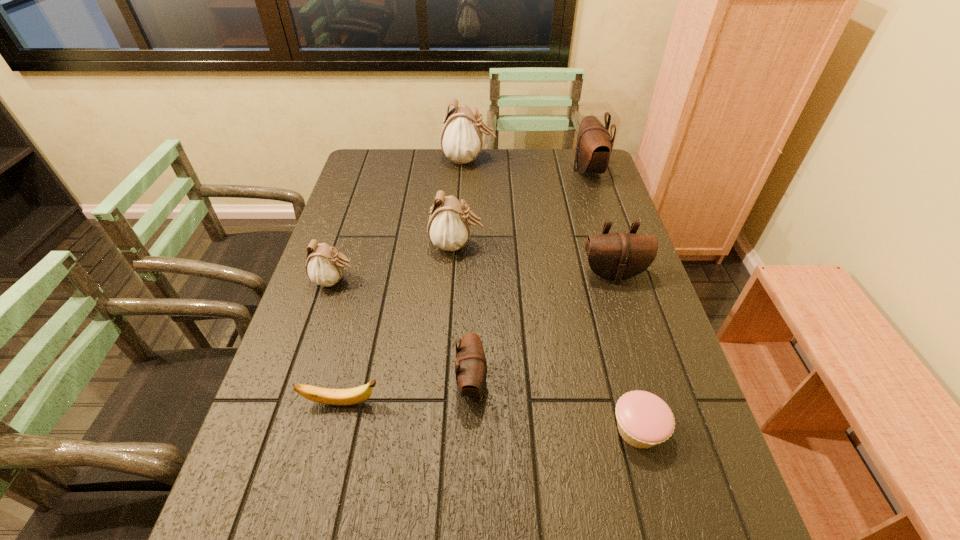
The width and height of the screenshot is (960, 540). I want to click on free location that satisfies the following two spatial constraints: 1. on the back side of the pink cupcake; 2. on the front-facing side of the second farthest white pouch, so click(589, 245).